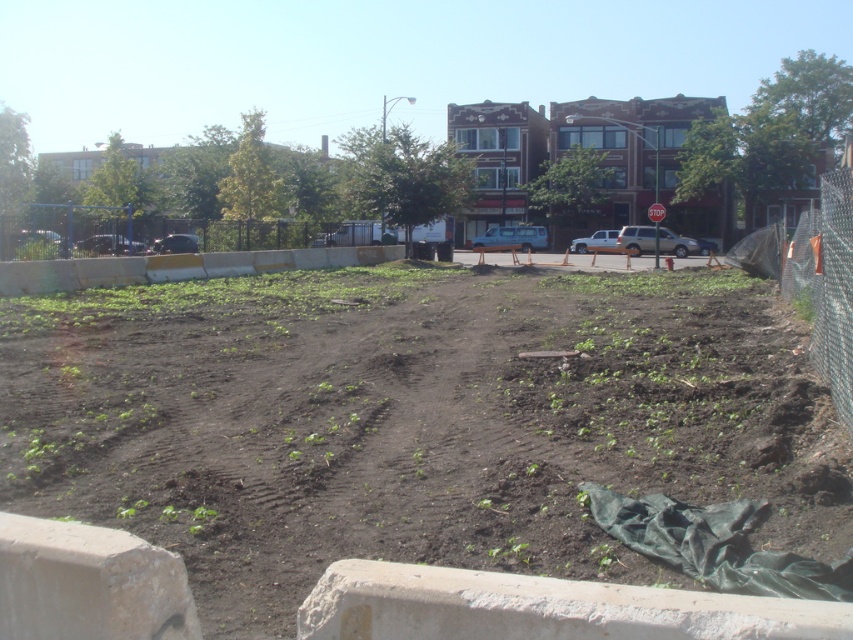
Question: Where is dark brown soil at center located in relation to black metal fence at left in the image?

Choices:
 (A) right
 (B) left

Answer: (A)

Question: Which object appears closest to the camera in this image?

Choices:
 (A) dark brown soil at center
 (B) chain-link fence at right

Answer: (A)

Question: Which object appears closest to the camera in this image?

Choices:
 (A) dark brown soil at center
 (B) chain-link fence at right

Answer: (A)

Question: Can you confirm if dark brown soil at center is thinner than chain-link fence at right?

Choices:
 (A) no
 (B) yes

Answer: (A)

Question: Does dark brown soil at center have a larger size compared to black metal fence at left?

Choices:
 (A) no
 (B) yes

Answer: (A)

Question: Which of the following is the closest to the observer?

Choices:
 (A) (204, 248)
 (B) (807, 273)

Answer: (B)